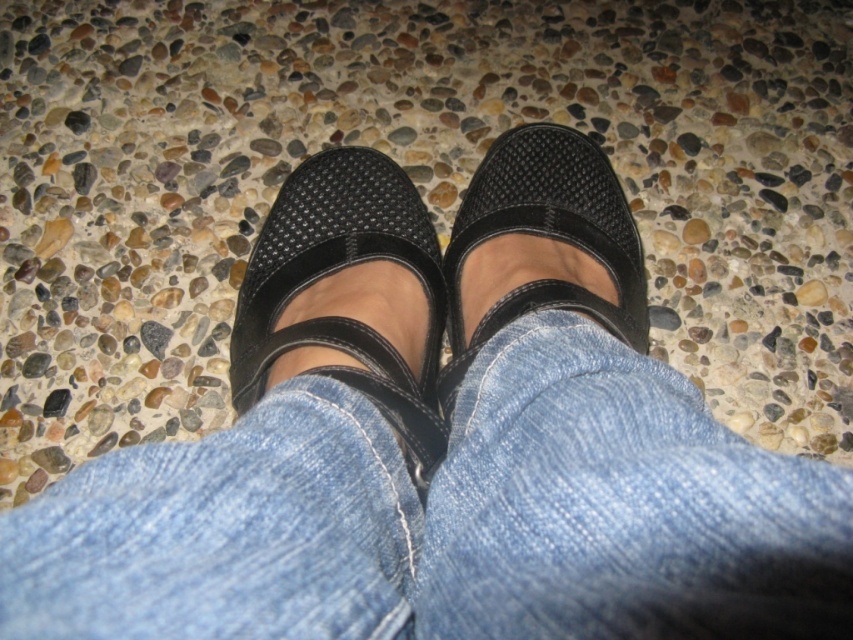
You are standing in a room with a gravel floor and wearing black Mary Jane shoes. You notice a point marked at coordinates (447, 518). What material is located at that point?

The point at (447, 518) marks denim at center.

You are standing in front of the person whose feet are shown in the image. You want to pick up an object located at point (303, 346) and another object at point (508, 170). Which point do you need to bend down more to reach?

You need to bend down more to reach point (508, 170) because it is further away from the camera compared to point (303, 346), which is closer.

You are a shoe designer examining two pairs of shoes in the image. The matte black mary jane shoes at center and the black mesh sandal at center. Which one has a higher height?

The matte black mary jane shoes at center is taller than the black mesh sandal at center according to the description.